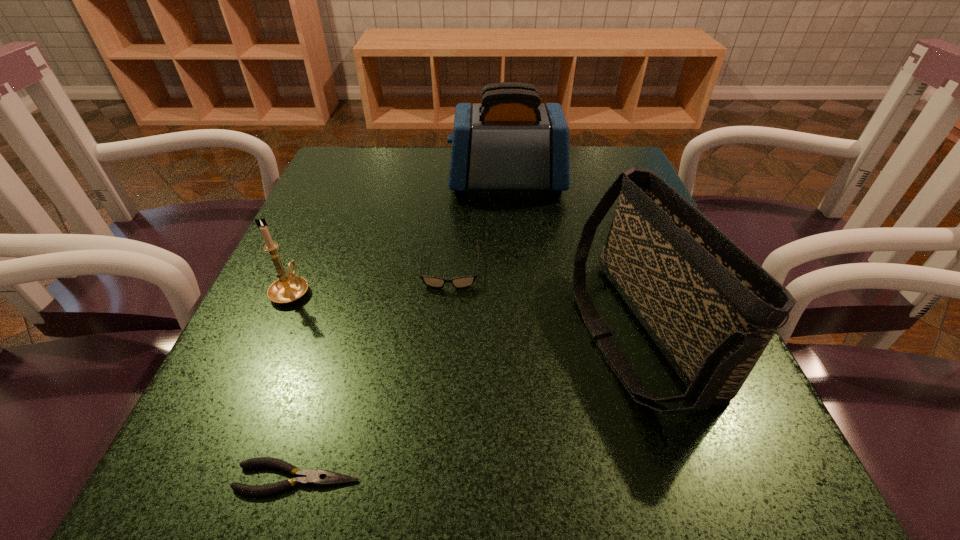
The width and height of the screenshot is (960, 540). I want to click on free point located 0.360m on the left of the handbag, so click(346, 332).

Find the location of `free spot located 0.330m on the handle side of the candle holder`. free spot located 0.330m on the handle side of the candle holder is located at coordinates (342, 177).

Identify the location of vacant space located on the handle side of the candle holder. (340, 182).

The width and height of the screenshot is (960, 540). In order to click on free space located on the handle side of the candle holder in this screenshot , I will do `click(334, 194)`.

The height and width of the screenshot is (540, 960). Find the location of `free region located 0.290m on the front-facing side of the sunglasses`. free region located 0.290m on the front-facing side of the sunglasses is located at coordinates (436, 460).

Where is `free region located 0.060m on the left of the second object from left to right`? The height and width of the screenshot is (540, 960). free region located 0.060m on the left of the second object from left to right is located at coordinates (185, 478).

Where is `object that is positioned at the far edge`? The image size is (960, 540). object that is positioned at the far edge is located at coordinates (510, 141).

Identify the location of handbag that is at the near edge. The height and width of the screenshot is (540, 960). (711, 309).

You are a GUI agent. You are given a task and a screenshot of the screen. Output one action in this format:
    pyautogui.click(x=<x>, y=<y>)
    Task: Click on the pliers present at the near edge
    The height and width of the screenshot is (540, 960).
    Given the screenshot: What is the action you would take?
    pyautogui.click(x=307, y=477)

Where is `candle holder at the left edge`? candle holder at the left edge is located at coordinates tap(287, 289).